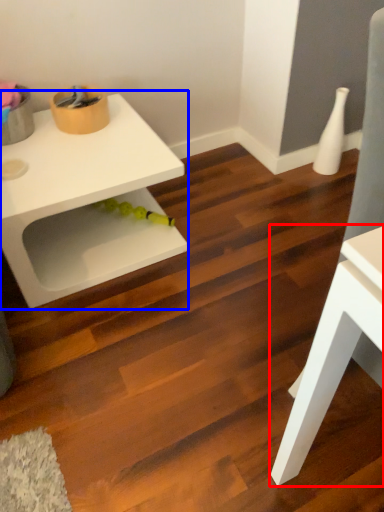
Question: Which of the following is the farthest to the observer, table (highlighted by a red box) or table (highlighted by a blue box)?

Choices:
 (A) table
 (B) table

Answer: (B)